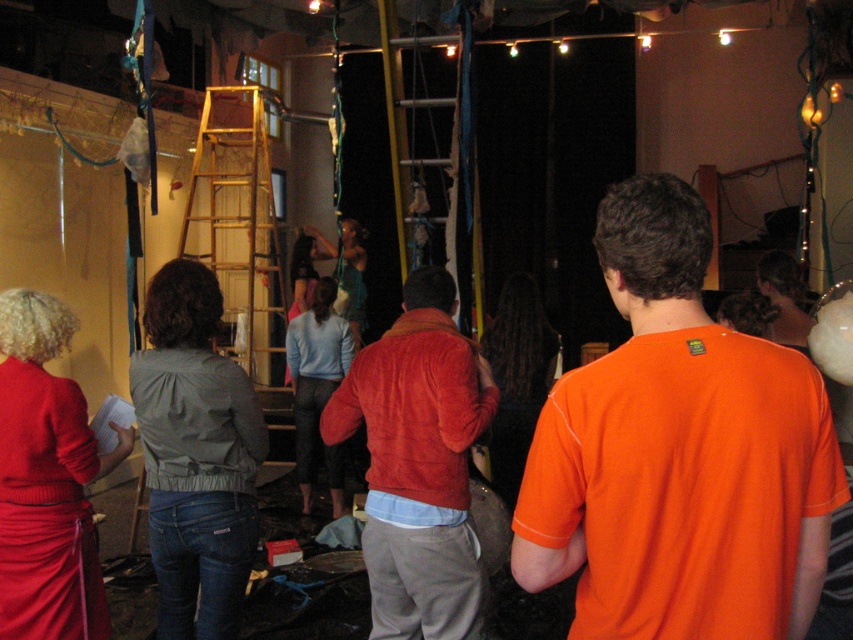
Question: Can you confirm if velvet red jacket at center is bigger than light blue sweater at center?

Choices:
 (A) no
 (B) yes

Answer: (A)

Question: Observing the image, what is the correct spatial positioning of matte red sweater at lower left in reference to wooden at left?

Choices:
 (A) left
 (B) right

Answer: (B)

Question: Among these points, which one is nearest to the camera?

Choices:
 (A) (231, 496)
 (B) (335, 317)
 (C) (669, 198)
 (D) (419, 532)

Answer: (C)

Question: Which object is the farthest from the matte gray blouse at center?

Choices:
 (A) light blue sweater at center
 (B) wooden at left
 (C) orange t-shirt at center
 (D) velvet red jacket at center

Answer: (B)

Question: Does orange t-shirt at center have a greater width compared to matte gray blouse at center?

Choices:
 (A) yes
 (B) no

Answer: (A)

Question: Which point is farther from the camera taking this photo?

Choices:
 (A) (334, 368)
 (B) (289, 429)
 (C) (380, 419)
 (D) (33, 365)

Answer: (B)